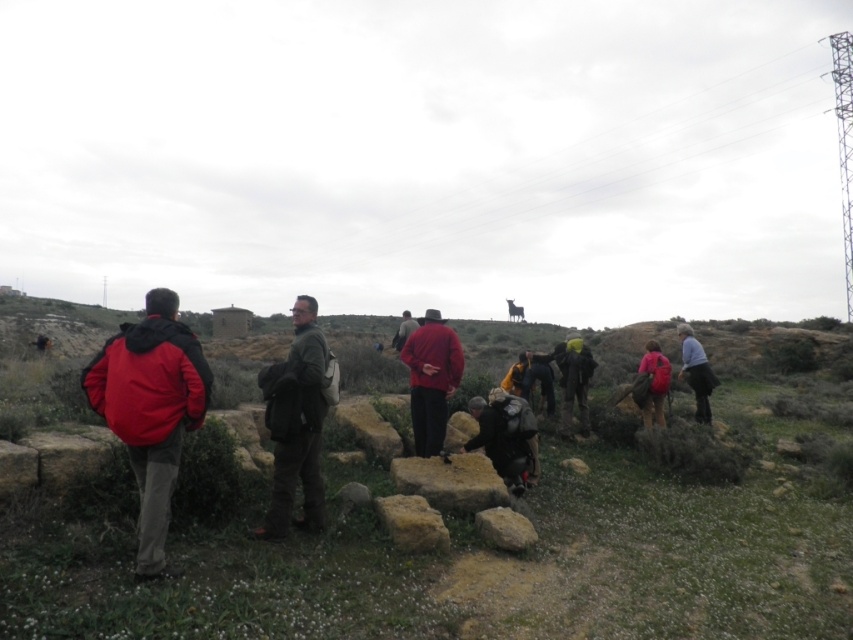
Question: Which point is farther to the camera?

Choices:
 (A) green fuzzy jacket at center
 (B) matte red jacket at center

Answer: (A)

Question: Which point is closer to the camera?

Choices:
 (A) (468, 513)
 (B) (421, 516)
 (C) (410, 330)
 (D) (144, 294)

Answer: (B)

Question: Among these objects, which one is nearest to the camera?

Choices:
 (A) smooth gray rock at center
 (B) matte red jacket at center
 (C) brown rough stone at center
 (D) red matte jacket at left

Answer: (D)

Question: Is metallic wire at upper center above smooth gray rock at center?

Choices:
 (A) yes
 (B) no

Answer: (A)

Question: Does matte red jacket at center come behind dark gray backpack at center?

Choices:
 (A) yes
 (B) no

Answer: (A)

Question: Is metallic wire at upper center to the left of red matte jacket at left from the viewer's perspective?

Choices:
 (A) yes
 (B) no

Answer: (B)